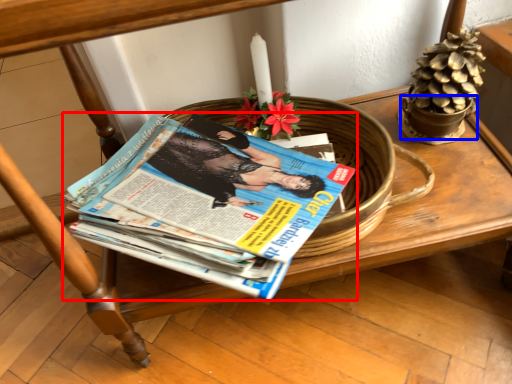
Question: Which point is further to the camera, book (highlighted by a red box) or flowerpot (highlighted by a blue box)?

Choices:
 (A) book
 (B) flowerpot

Answer: (B)